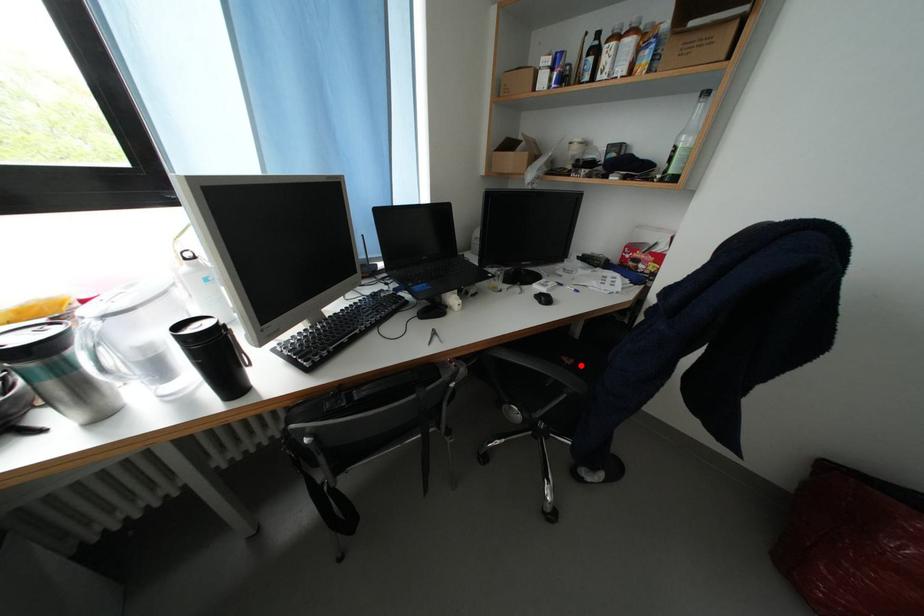
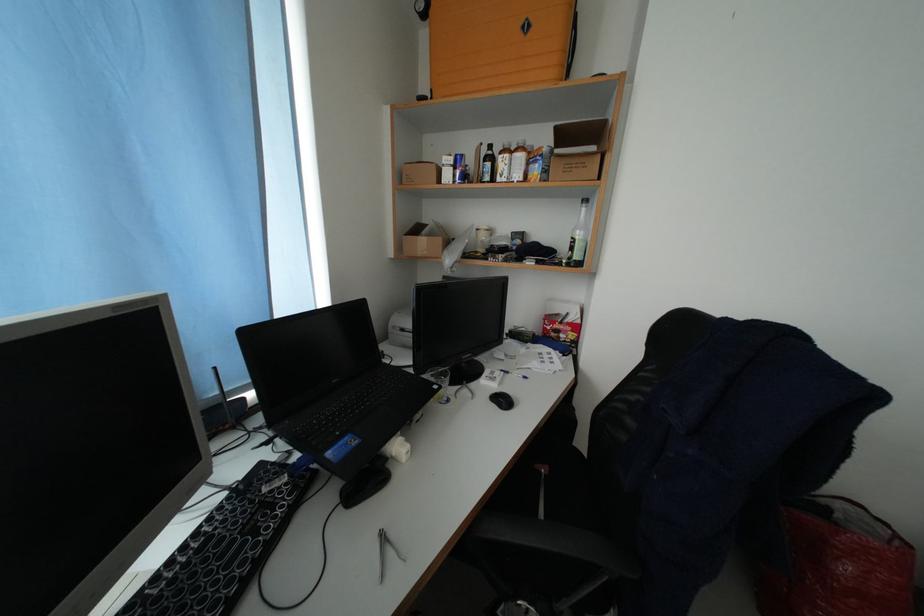
The point at the highlighted location is marked in the first image. Where is the corresponding point in the second image?

(555, 472)